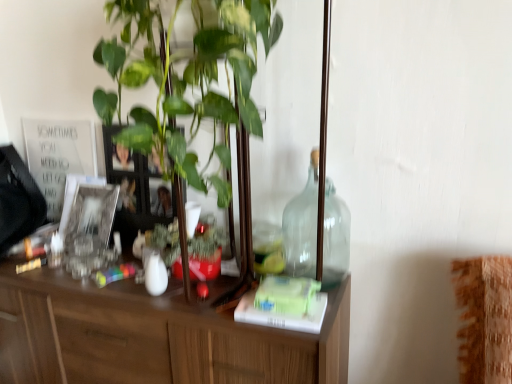
Question: Is white glossy vase at center at the left side of transparent glass bottle at center-right?

Choices:
 (A) no
 (B) yes

Answer: (B)

Question: Is white glossy vase at center oriented away from transparent glass bottle at center-right?

Choices:
 (A) no
 (B) yes

Answer: (A)

Question: Is white glossy vase at center far from transparent glass bottle at center-right?

Choices:
 (A) yes
 (B) no

Answer: (B)

Question: Can we say white glossy vase at center lies outside transparent glass bottle at center-right?

Choices:
 (A) no
 (B) yes

Answer: (B)

Question: Considering the relative sizes of white glossy vase at center and transparent glass bottle at center-right in the image provided, is white glossy vase at center smaller than transparent glass bottle at center-right?

Choices:
 (A) yes
 (B) no

Answer: (A)

Question: Is white glossy vase at center at the right side of transparent glass bottle at center-right?

Choices:
 (A) no
 (B) yes

Answer: (A)

Question: Is green matte book at center in front of transparent glass bottle at center-right?

Choices:
 (A) no
 (B) yes

Answer: (B)

Question: Is transparent glass bottle at center-right completely or partially inside green matte book at center?

Choices:
 (A) no
 (B) yes

Answer: (A)

Question: From the image's perspective, does green matte book at center appear lower than transparent glass bottle at center-right?

Choices:
 (A) yes
 (B) no

Answer: (A)

Question: From a real-world perspective, is green matte book at center positioned under transparent glass bottle at center-right based on gravity?

Choices:
 (A) no
 (B) yes

Answer: (B)

Question: From a real-world perspective, does green matte book at center stand above transparent glass bottle at center-right?

Choices:
 (A) yes
 (B) no

Answer: (B)

Question: Can you confirm if green matte book at center is positioned to the right of transparent glass bottle at center-right?

Choices:
 (A) yes
 (B) no

Answer: (B)

Question: From the image's perspective, would you say green matte book at center is shown under silver metallic picture frame at left?

Choices:
 (A) yes
 (B) no

Answer: (A)